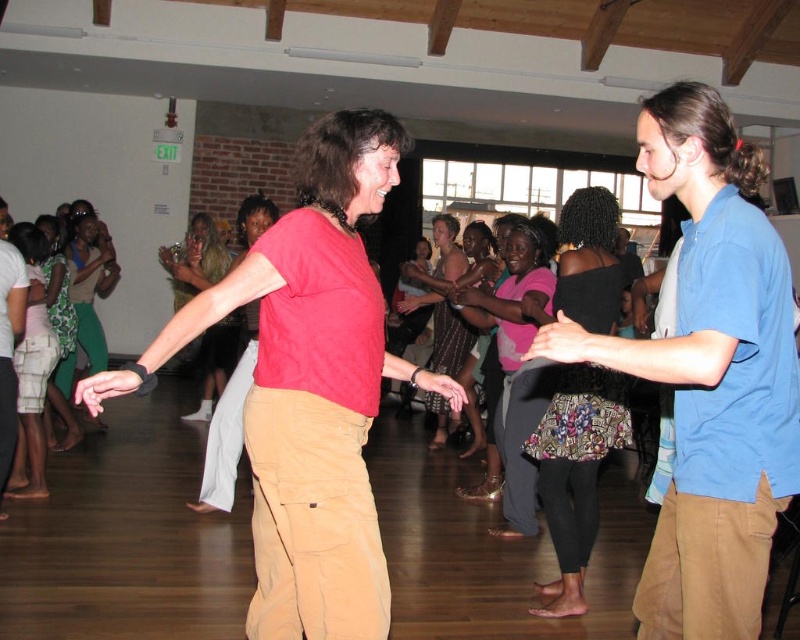
You are standing in the dance scene described. You need to locate the khaki pants at right. According to the coordinates provided, where exactly would you look to find them?

The khaki pants at right are located at point 0.588 on the x axis and 0.889 on the y axis.

You are planning to take a photo of the green textured dress at left and the green textured dress at lower left. Which dress should you focus on first if you want to capture both in a single frame without moving the camera?

You should focus on the green textured dress at left first because it is above the green textured dress at lower left, so it will be in the upper part of the frame while the lower one will naturally be included below.

You are standing at the entrance of the room and want to reach the point marked as point (92, 268). However, there is an obstacle at point (52, 248). Can you walk straight towards your destination without going around the obstacle?

Point (92, 268) is behind point (52, 248), so you cannot walk straight to point (92, 268) without passing through the obstacle at point (52, 248). You will need to go around the obstacle.